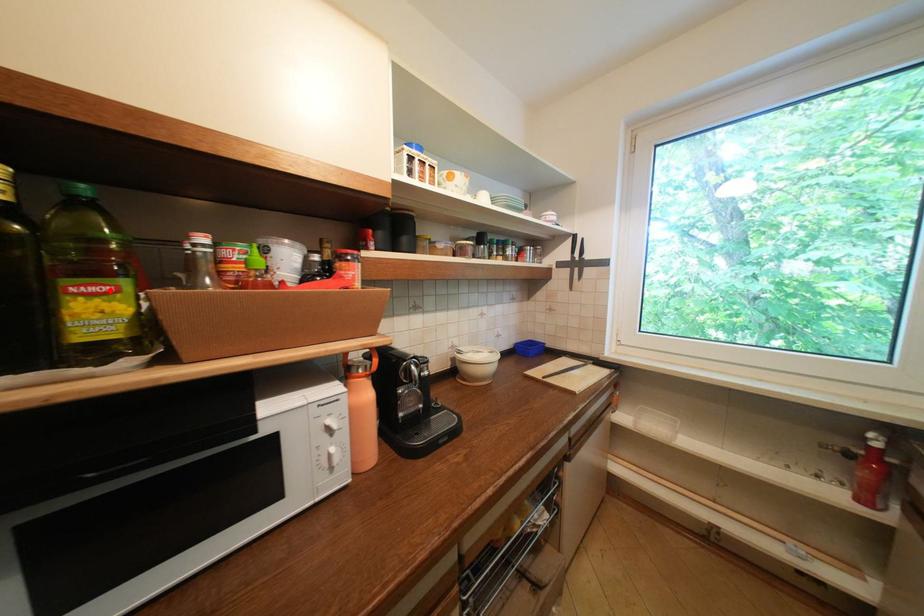
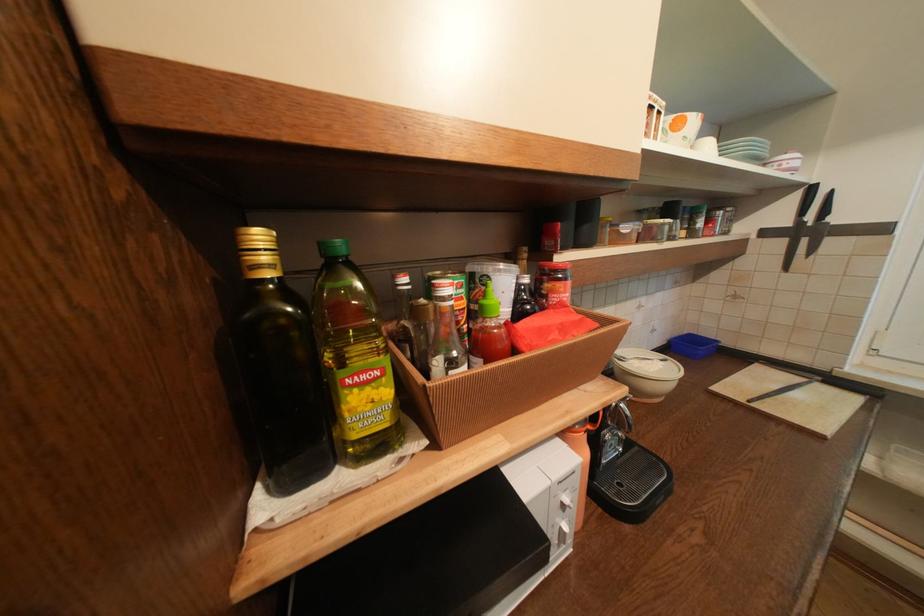
The point at the highlighted location is marked in the first image. Where is the corresponding point in the second image?

(379, 377)